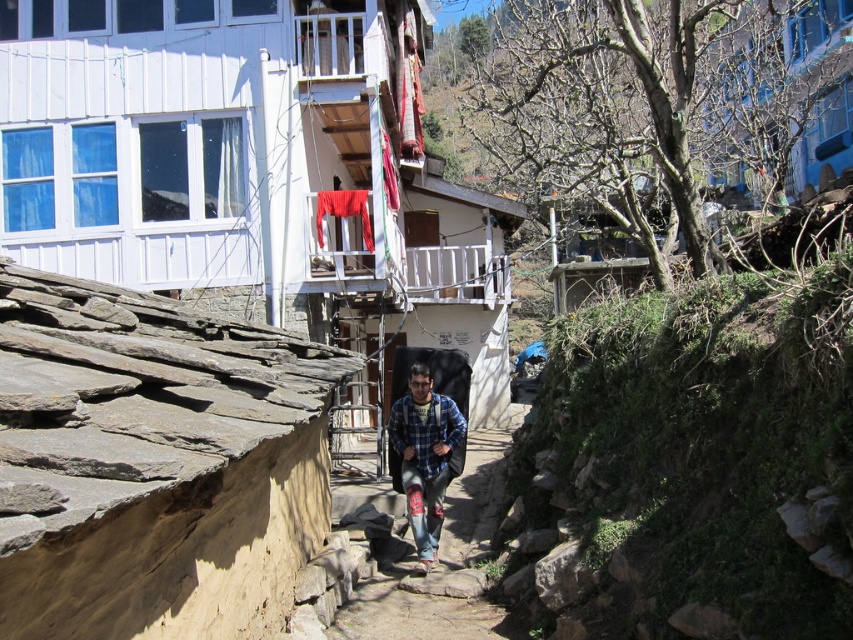
You are a delivery drone operator. Your drone has a maximum payload capacity of 5 feet in length. You need to transport both the denim jeans at center and the blue plaid shirt at center in a single trip. Can the drone carry both items together without exceeding its length capacity?

The distance between denim jeans at center and blue plaid shirt at center is 4.92 feet, which is within the drone payload length capacity of 5 feet. Therefore, the drone can carry both items together in one trip.

Where is the denim jeans at center located in the image?

The denim jeans at center is located at point (439, 563).

You are a photographer trying to capture the man in the denim jeans at center and blue plaid shirt at center. Which clothing item is located to the right of the other?

The denim jeans at center is positioned on the right side of blue plaid shirt at center.